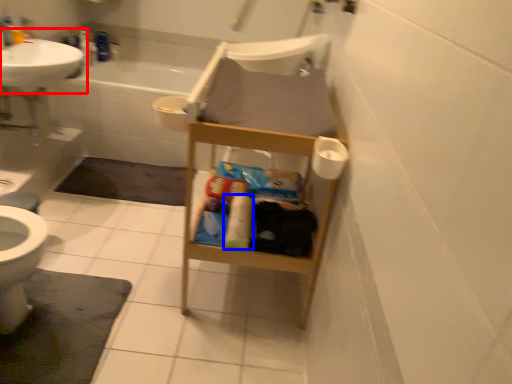
Question: Among these objects, which one is farthest to the camera, sink (highlighted by a red box) or toilet paper (highlighted by a blue box)?

Choices:
 (A) sink
 (B) toilet paper

Answer: (A)